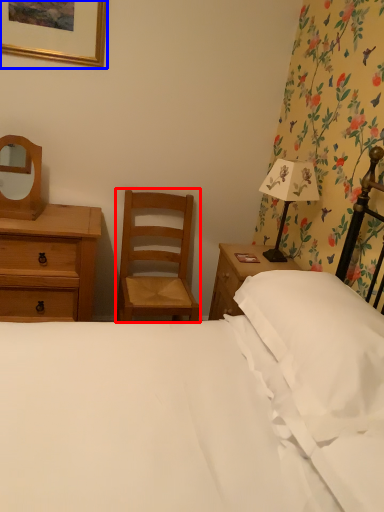
Question: Which of the following is the closest to the observer, chair (highlighted by a red box) or picture frame (highlighted by a blue box)?

Choices:
 (A) chair
 (B) picture frame

Answer: (B)